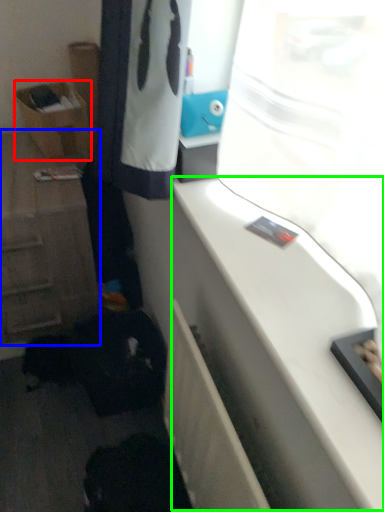
Question: Based on their relative distances, which object is nearer to shelf (highlighted by a red box)? Choose from cabinetry (highlighted by a blue box) and counter top (highlighted by a green box).

Choices:
 (A) cabinetry
 (B) counter top

Answer: (A)